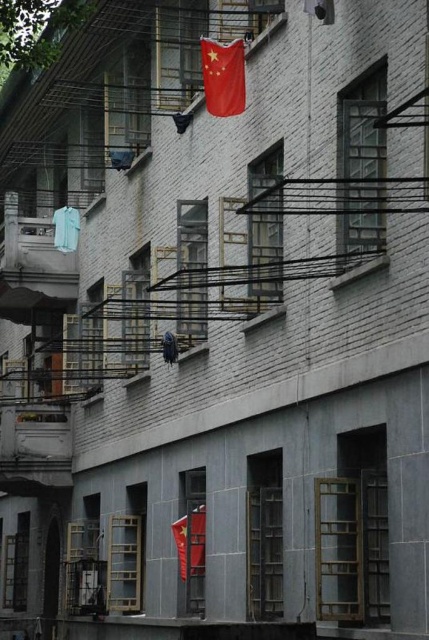
You are standing in front of a residential building and notice two fabrics on the exterior. The first is a red fabric flag at center, and the second is a light blue fabric at left. Which fabric is positioned to the right when viewed from your perspective?

The red fabric flag at center is positioned to the right of the light blue fabric at left.

You are standing in front of the residential building and want to take a photo of the two points mentioned. Which point, point (x=193, y=563) or point (x=53, y=221), will appear larger in the photo?

Point (x=193, y=563) is closer to the camera than point (x=53, y=221), so it will appear larger in the photo.